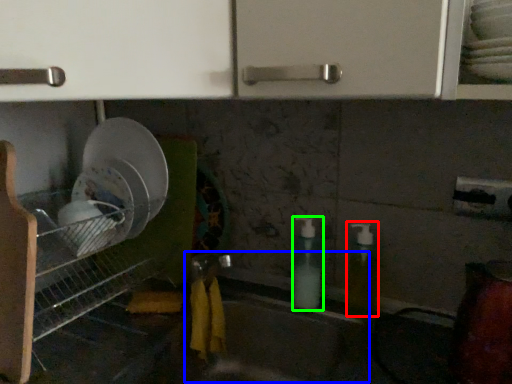
Question: Which object is the closest to the soap dispenser (highlighted by a red box)? Choose among these: sink (highlighted by a blue box) or soap dispenser (highlighted by a green box).

Choices:
 (A) sink
 (B) soap dispenser

Answer: (B)